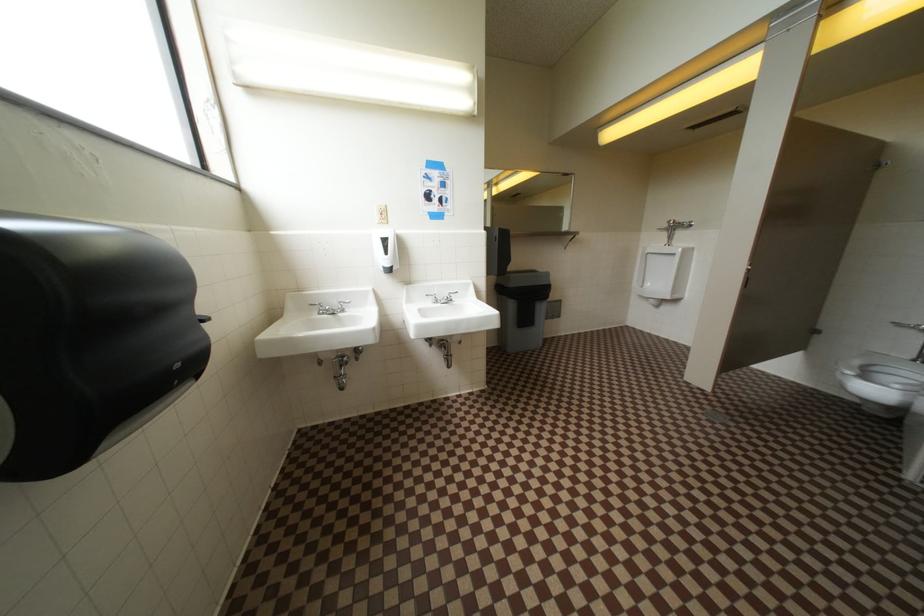
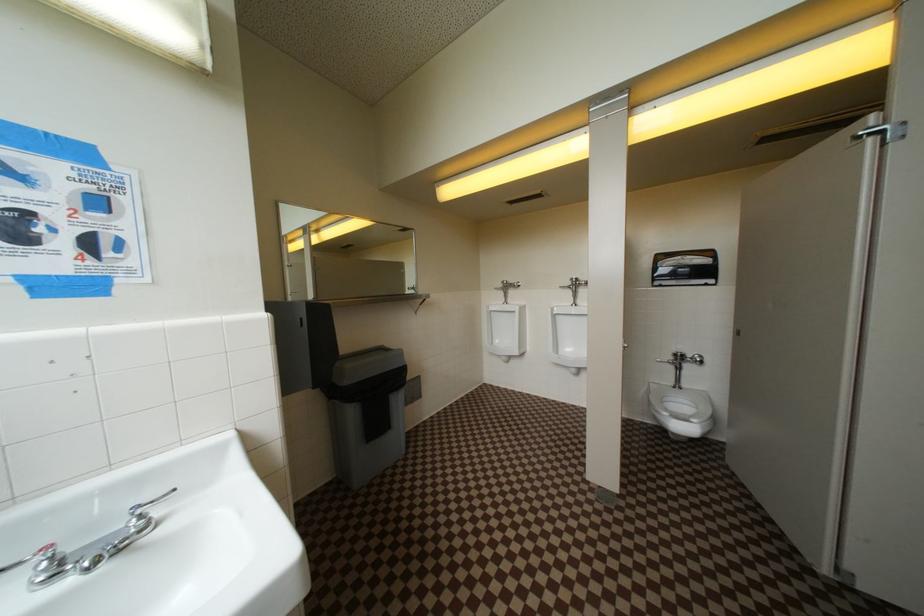
Question: The camera is either moving clockwise (left) or counter-clockwise (right) around the object. The first image is from the beginning of the video and the second image is from the end. Is the camera moving left or right when shooting the video?

Choices:
 (A) Left
 (B) Right

Answer: (A)